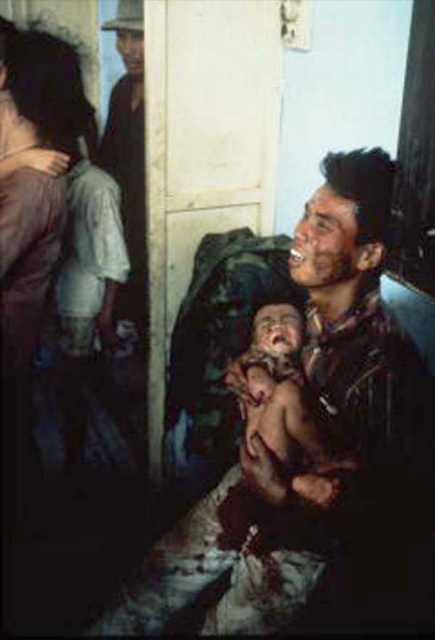
You are a healthcare worker assessing the situation in the image. The dirty brown shirt at center and the skinny baby at center are both in the center of the scene. Which object is positioned higher up in the image?

The dirty brown shirt at center is taller than the skinny baby at center, so the dirty brown shirt at center is positioned higher up in the image.

You are a clothing designer observing the scene. You need to determine if the dirty brown shirt at center can be altered to fit the skinny baby at center. Based on the given information, can the shirt be adjusted to fit the baby?

The dirty brown shirt at center is wider than the skinny baby at center, so it can be adjusted to fit the baby by tightening or resizing the shirt to match the baby.

You are a clothing designer observing the scene and need to recommend a size for a new baby outfit. Considering the matte purple shirt at left and the skinny baby at center, which object indicates the appropriate size for the baby outfit?

The skinny baby at center indicates the appropriate size for the baby outfit since the matte purple shirt at left is larger in size compared to the skinny baby at center.